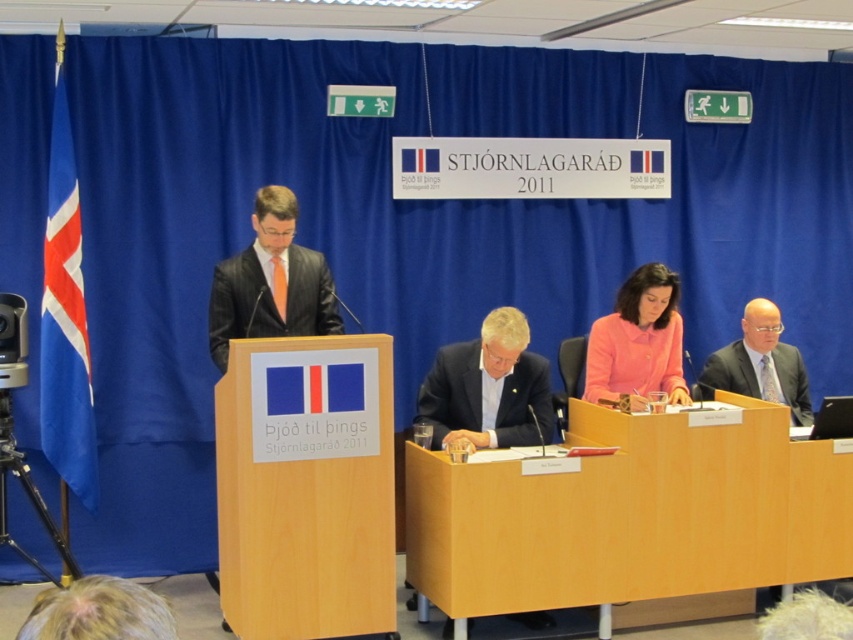
Can you confirm if matte black suit at center is taller than matte black suit at right?

Correct, matte black suit at center is much taller as matte black suit at right.

The width and height of the screenshot is (853, 640). What do you see at coordinates (270, 300) in the screenshot?
I see `matte black suit at center` at bounding box center [270, 300].

Does point (293, 324) come farther from viewer compared to point (732, 376)?

No, (293, 324) is closer to viewer.

At what (x,y) coordinates should I click in order to perform the action: click on matte black suit at center. Please return your answer as a coordinate pair (x, y). The image size is (853, 640). Looking at the image, I should click on (270, 300).

Can you confirm if dark blue fabric suit at center is positioned to the left of matte black suit at right?

Yes, dark blue fabric suit at center is to the left of matte black suit at right.

Which of these two, dark blue fabric suit at center or matte black suit at right, stands shorter?

matte black suit at right is shorter.

Does point (502, 420) lie behind point (700, 392)?

No, it is in front of (700, 392).

Locate an element on the screen. This screenshot has height=640, width=853. dark blue fabric suit at center is located at coordinates (482, 397).

Between point (553, 548) and point (73, 452), which one is positioned behind?

Positioned behind is point (73, 452).

Based on the photo, does light brown wood table at center have a larger size compared to blue fabric flag at left?

Yes, light brown wood table at center is bigger than blue fabric flag at left.

Locate an element on the screen. Image resolution: width=853 pixels, height=640 pixels. light brown wood table at center is located at coordinates (631, 513).

Locate an element on the screen. light brown wood table at center is located at coordinates (631, 513).